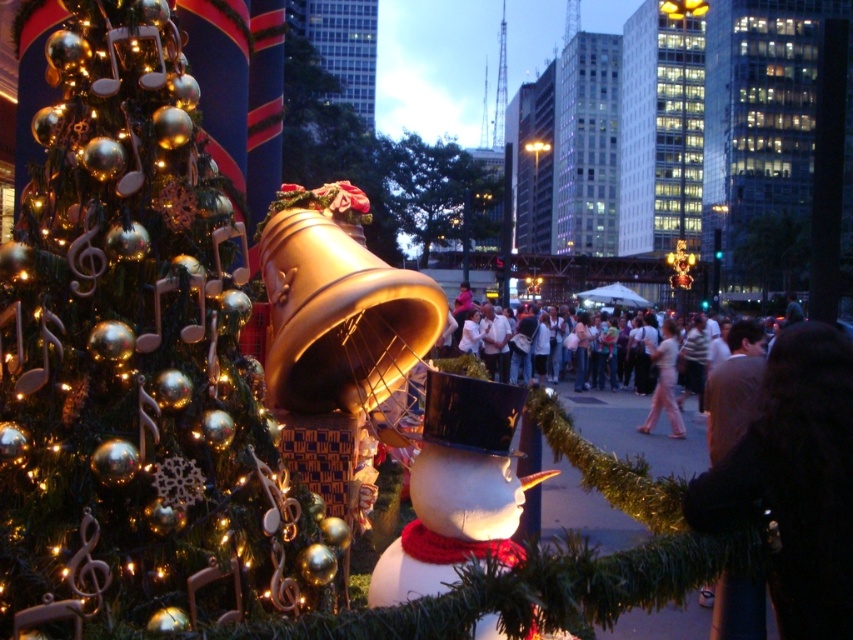
Find the location of a particular element. The width and height of the screenshot is (853, 640). white matte snowman at center is located at coordinates 457,490.

Is white matte snowman at center thinner than pink fabric pants at center?

In fact, white matte snowman at center might be wider than pink fabric pants at center.

Locate an element on the screen. The image size is (853, 640). white matte snowman at center is located at coordinates (457, 490).

You are a GUI agent. You are given a task and a screenshot of the screen. Output one action in this format:
    pyautogui.click(x=<x>, y=<y>)
    Task: Click on the white matte snowman at center
    The height and width of the screenshot is (640, 853).
    Given the screenshot: What is the action you would take?
    pyautogui.click(x=457, y=490)

Between shiny gold ornaments at left and pink fabric pants at center, which one is positioned higher?

Positioned higher is shiny gold ornaments at left.

In order to click on shiny gold ornaments at left in this screenshot , I will do `click(138, 364)`.

Does shiny gold ornaments at left have a lesser width compared to white matte snowman at center?

In fact, shiny gold ornaments at left might be wider than white matte snowman at center.

Does shiny gold ornaments at left have a greater height compared to white matte snowman at center?

Yes, shiny gold ornaments at left is taller than white matte snowman at center.

Does point (157, 234) come behind point (413, 547)?

No, it is not.

Locate an element on the screen. shiny gold ornaments at left is located at coordinates (138, 364).